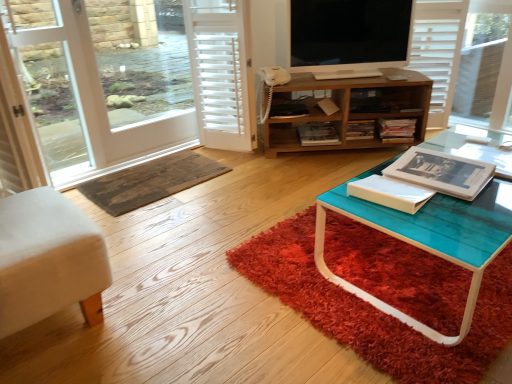
This screenshot has width=512, height=384. I want to click on vacant space in between wooden textured doormat at center, which is the second doormat in front-to-back order, and shaggy red rug at lower center, the second doormat from the left, so click(x=236, y=208).